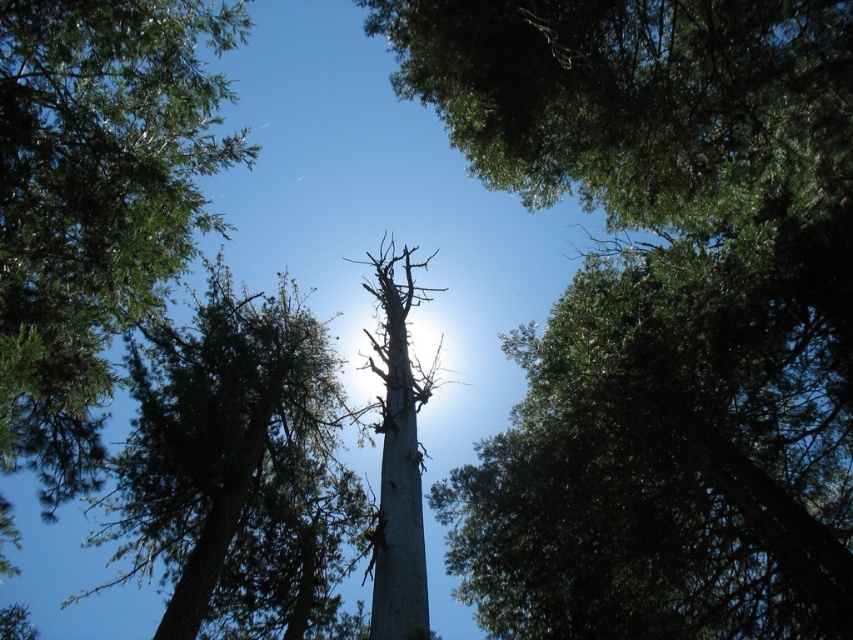
Does smooth gray trunk at center appear on the right side of green textured tree at center?

Yes, smooth gray trunk at center is to the right of green textured tree at center.

Where is `smooth gray trunk at center`? This screenshot has height=640, width=853. smooth gray trunk at center is located at coordinates point(660,312).

Can you confirm if green textured tree at center is positioned above gray bark tree at center?

Incorrect, green textured tree at center is not positioned above gray bark tree at center.

Is the position of green textured tree at center more distant than that of gray bark tree at center?

That is True.

The image size is (853, 640). What do you see at coordinates (236, 467) in the screenshot?
I see `green textured tree at center` at bounding box center [236, 467].

Locate an element on the screen. Image resolution: width=853 pixels, height=640 pixels. green textured tree at center is located at coordinates (236, 467).

Which is behind, point (62, 289) or point (207, 580)?

Positioned behind is point (207, 580).

Image resolution: width=853 pixels, height=640 pixels. What are the coordinates of `green leafy tree at upper left` in the screenshot? It's located at (96, 204).